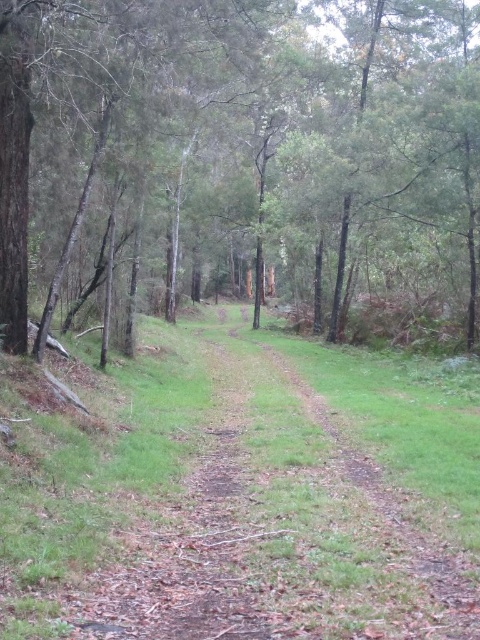
Question: Does green matte tree at center appear on the left side of brown dirt track at center?

Choices:
 (A) yes
 (B) no

Answer: (B)

Question: Is green matte tree at center bigger than brown dirt track at center?

Choices:
 (A) no
 (B) yes

Answer: (B)

Question: Which point appears closest to the camera in this image?

Choices:
 (A) (351, 77)
 (B) (409, 563)

Answer: (B)

Question: Does green matte tree at center have a greater width compared to brown dirt track at center?

Choices:
 (A) no
 (B) yes

Answer: (B)